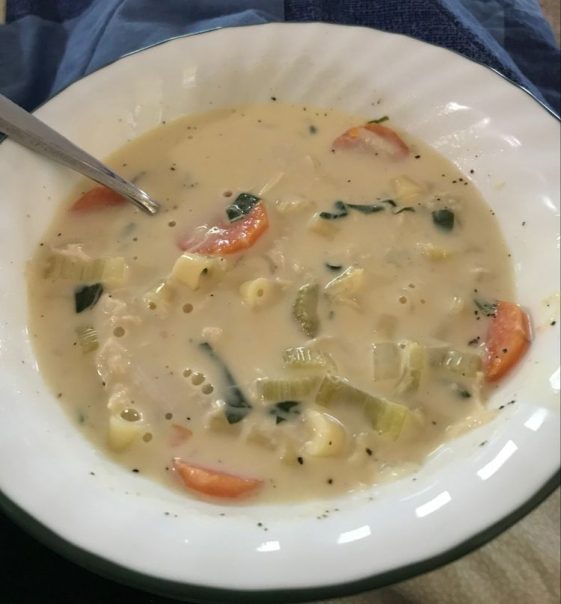
Image resolution: width=561 pixels, height=604 pixels. Find the location of `wood table`. wood table is located at coordinates (519, 573).